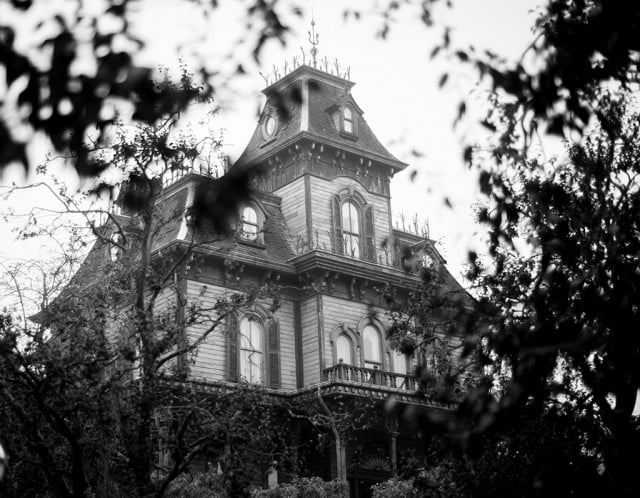
You are a GUI agent. You are given a task and a screenshot of the screen. Output one action in this format:
    pyautogui.click(x=<x>, y=<y>)
    Task: Click on the window
    This screenshot has height=498, width=640.
    Given the screenshot: What is the action you would take?
    [276, 124], [347, 125], [349, 217], [252, 216], [427, 263], [397, 359], [374, 349], [347, 351], [253, 363], [113, 258]